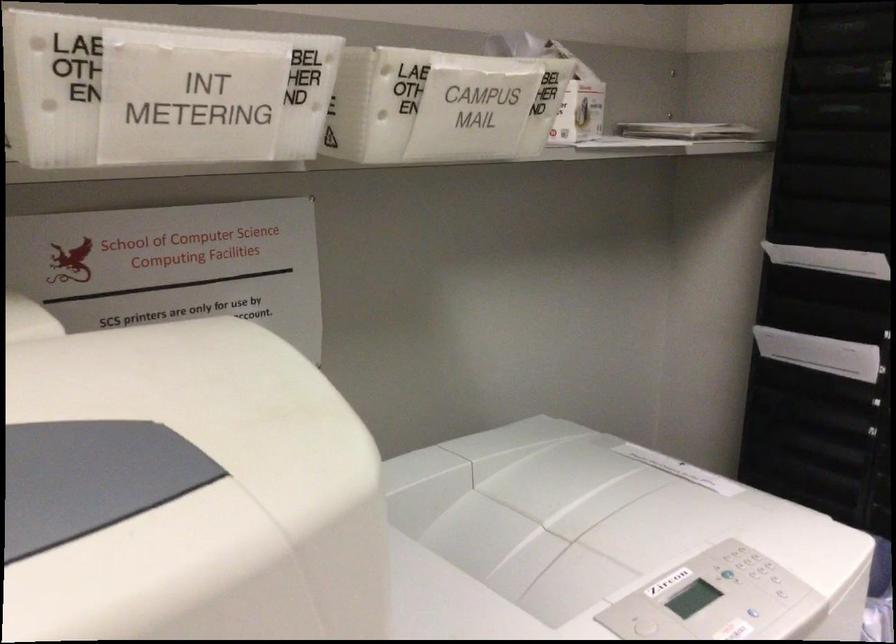
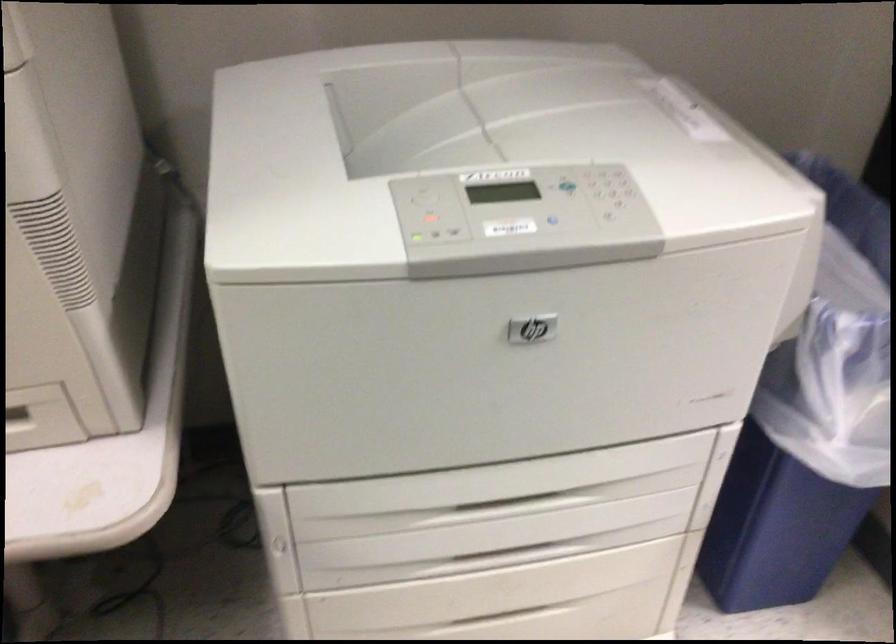
Based on the continuous images, in which direction is the camera rotating?

The camera rotated toward left-down.